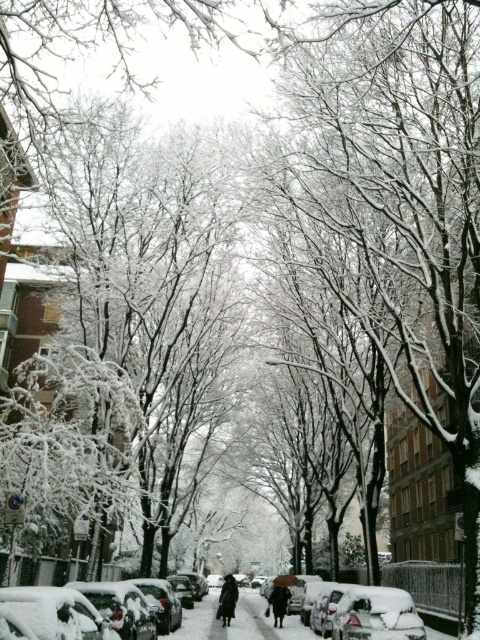
Question: Is snow-covered car at lower center thinner than black matte coat at center?

Choices:
 (A) no
 (B) yes

Answer: (A)

Question: Which object appears farthest from the camera in this image?

Choices:
 (A) dark brown coat at center
 (B) white matte car at center

Answer: (A)

Question: Is white matte car at center smaller than snow-covered car at lower center?

Choices:
 (A) no
 (B) yes

Answer: (B)

Question: Does snow-covered car at lower center have a greater width compared to black matte coat at center?

Choices:
 (A) yes
 (B) no

Answer: (A)

Question: Which of the following is the farthest from the observer?

Choices:
 (A) snow-covered car at lower center
 (B) dark brown coat at center

Answer: (B)

Question: Which point is closer to the camera?

Choices:
 (A) white matte car at center
 (B) snow-covered car at lower center
 (C) dark brown coat at center

Answer: (B)